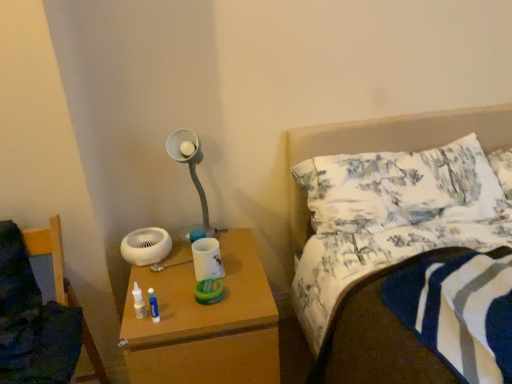
Question: From a real-world perspective, is wooden nightstand at lower center below wooden chair at lower left?

Choices:
 (A) yes
 (B) no

Answer: (A)

Question: Can you confirm if wooden nightstand at lower center is wider than wooden chair at lower left?

Choices:
 (A) yes
 (B) no

Answer: (A)

Question: Is wooden nightstand at lower center positioned behind wooden chair at lower left?

Choices:
 (A) yes
 (B) no

Answer: (A)

Question: From the image's perspective, is wooden nightstand at lower center under wooden chair at lower left?

Choices:
 (A) yes
 (B) no

Answer: (A)

Question: Is wooden nightstand at lower center to the right of wooden chair at lower left from the viewer's perspective?

Choices:
 (A) no
 (B) yes

Answer: (B)

Question: Does wooden nightstand at lower center have a greater height compared to wooden chair at lower left?

Choices:
 (A) no
 (B) yes

Answer: (A)

Question: Can we say wooden chair at lower left lies outside wooden nightstand at lower center?

Choices:
 (A) yes
 (B) no

Answer: (A)

Question: From a real-world perspective, is wooden chair at lower left on top of wooden nightstand at lower center?

Choices:
 (A) no
 (B) yes

Answer: (B)

Question: Is wooden chair at lower left turned away from wooden nightstand at lower center?

Choices:
 (A) no
 (B) yes

Answer: (A)

Question: Does wooden chair at lower left appear on the right side of wooden nightstand at lower center?

Choices:
 (A) yes
 (B) no

Answer: (B)

Question: Does wooden chair at lower left come in front of wooden nightstand at lower center?

Choices:
 (A) no
 (B) yes

Answer: (B)

Question: Is wooden chair at lower left thinner than wooden nightstand at lower center?

Choices:
 (A) yes
 (B) no

Answer: (A)

Question: Is white printed fabric pillow at upper right bigger than wooden chair at lower left?

Choices:
 (A) no
 (B) yes

Answer: (A)